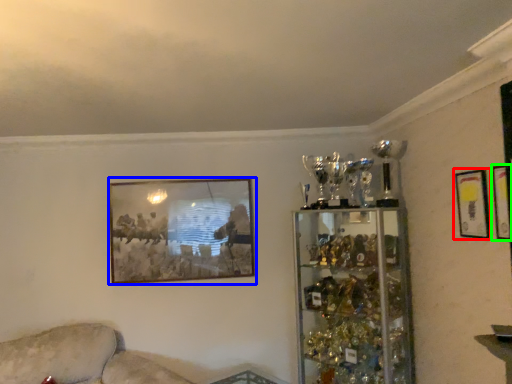
Question: Based on their relative distances, which object is farther from picture frame (highlighted by a red box)? Choose from picture frame (highlighted by a blue box) and picture frame (highlighted by a green box).

Choices:
 (A) picture frame
 (B) picture frame

Answer: (A)